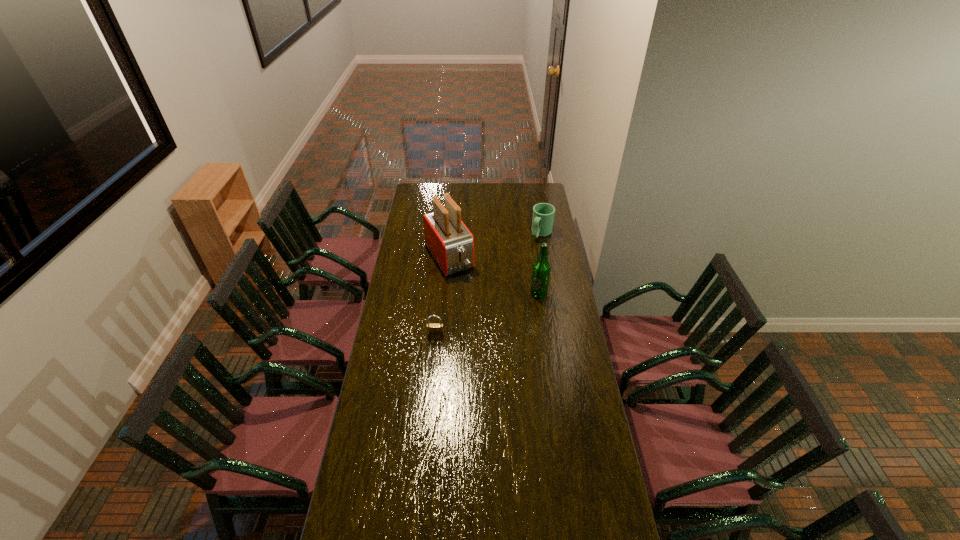
Identify the location of free space on the desktop that is between the nearest object and the beer bottle and is positioned on the front-facing side of the toaster. Image resolution: width=960 pixels, height=540 pixels. (488, 314).

Locate an element on the screen. This screenshot has width=960, height=540. free space on the desktop that is between the shortest object and the beer bottle and is positioned on the side of the third tallest object with the handle is located at coordinates (480, 317).